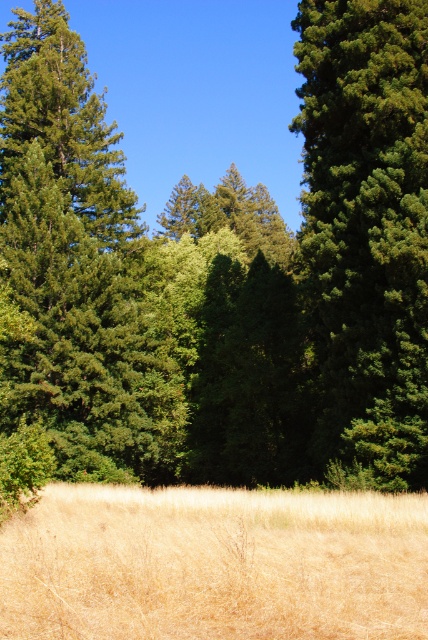
Question: Which point is closer to the camera?

Choices:
 (A) dry grass at center
 (B) green matte tree at right

Answer: (A)

Question: Does dry grass at center appear on the left side of green matte tree at right?

Choices:
 (A) yes
 (B) no

Answer: (A)

Question: Does dry grass at center have a greater width compared to green matte tree at right?

Choices:
 (A) yes
 (B) no

Answer: (A)

Question: Which object is closer to the camera taking this photo?

Choices:
 (A) dry grass at center
 (B) green matte tree at right

Answer: (A)

Question: Is dry grass at center bigger than green matte tree at right?

Choices:
 (A) no
 (B) yes

Answer: (A)